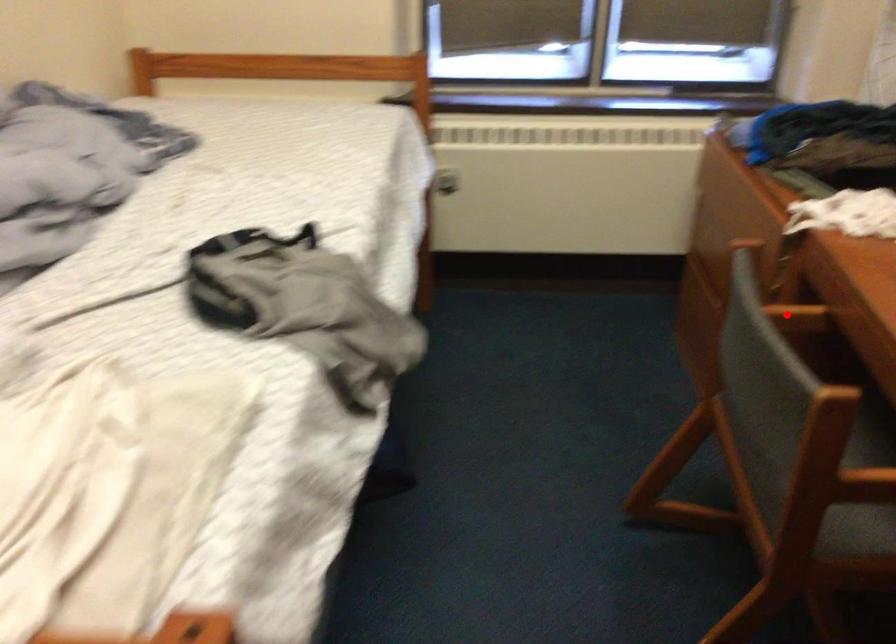
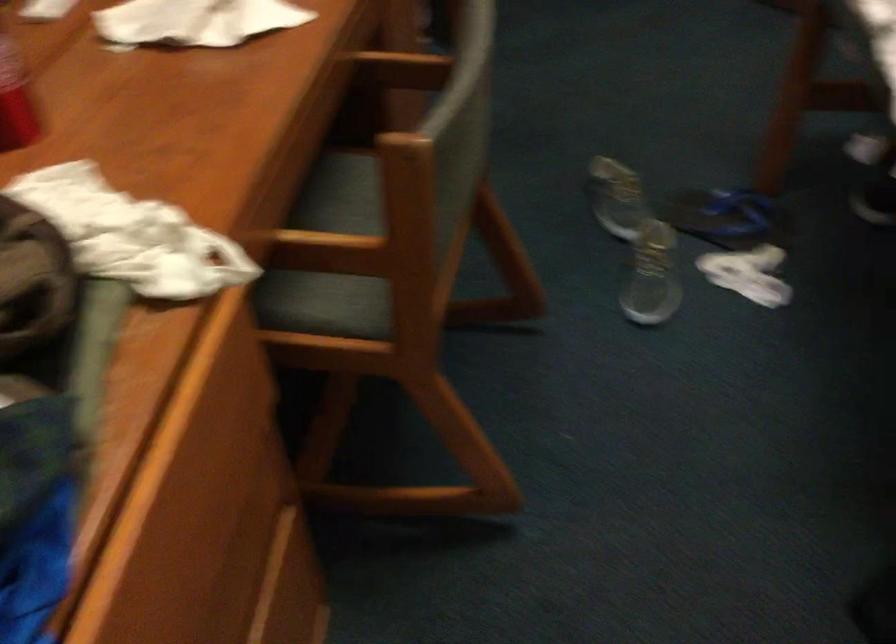
Question: A red point is marked in image1. In image2, is the corresponding 3D point closer to the camera or farther? Reply with the corresponding letter.

Choices:
 (A) The corresponding 3D point is closer.
 (B) The corresponding 3D point is farther.

Answer: (A)